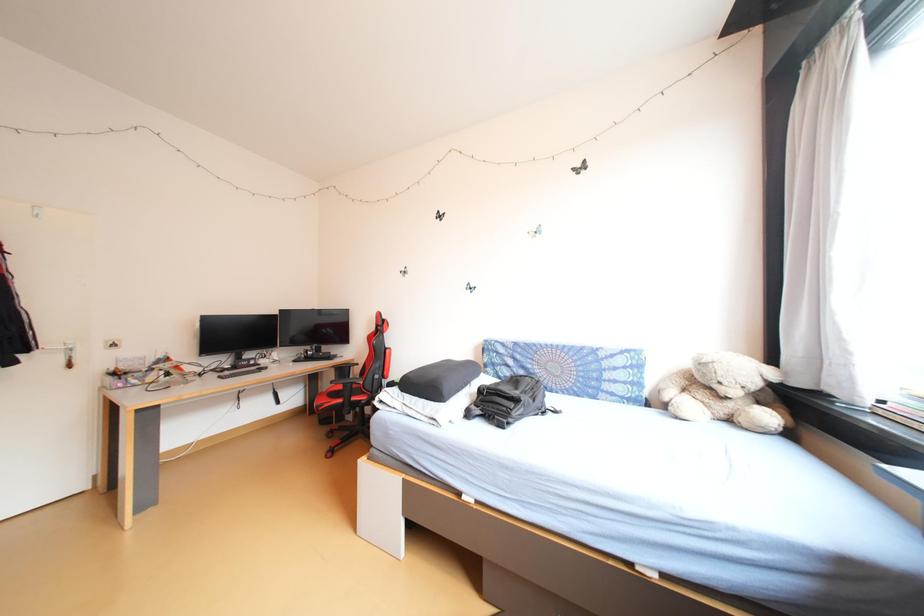
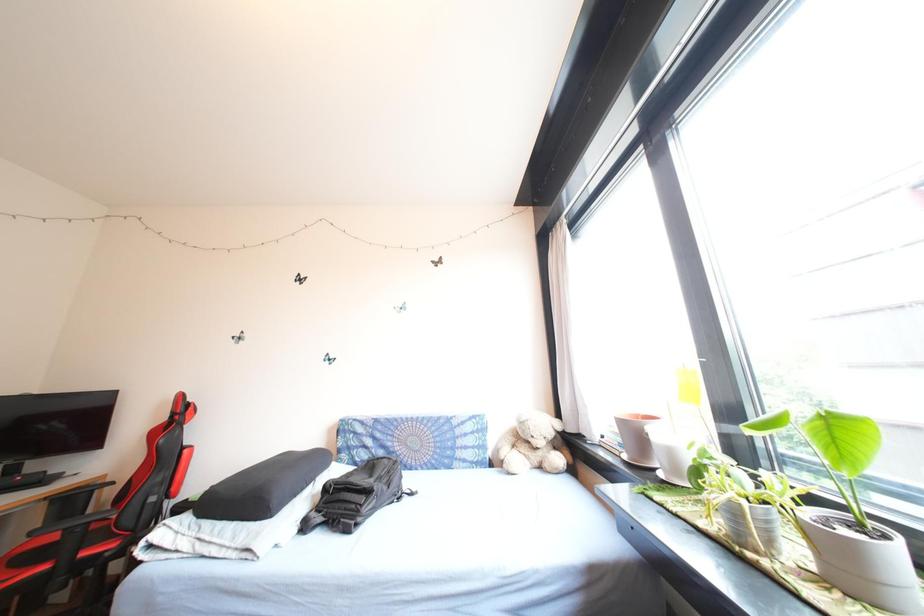
Question: Based on the continuous images, in which direction is the camera rotating? Reply with the corresponding letter.

Choices:
 (A) Left
 (B) Right
 (C) Up
 (D) Down

Answer: (B)